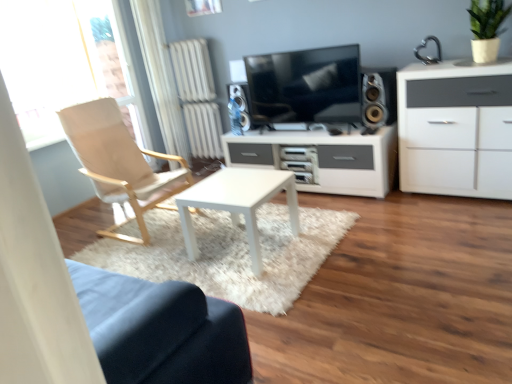
Question: Based on their sizes in the image, would you say matte black tv at center is bigger or smaller than white matte cabinet at right?

Choices:
 (A) small
 (B) big

Answer: (A)

Question: Considering the positions of matte black tv at center and white matte cabinet at right in the image, is matte black tv at center taller or shorter than white matte cabinet at right?

Choices:
 (A) short
 (B) tall

Answer: (A)

Question: Considering the real-world distances, which object is farthest from the light beige fabric chair at left?

Choices:
 (A) white fabric curtain at left
 (B) satin black speaker at center, the second speaker in the front-to-back sequence
 (C) matte black tv at center
 (D) green matte plant at upper right
 (E) silver metallic speaker at right, which ranks as the 2th speaker in left-to-right order

Answer: (D)

Question: Considering the real-world distances, which object is farthest from the white fabric curtain at left?

Choices:
 (A) white matte cabinet at right
 (B) green matte plant at upper right
 (C) white matte coffee table at center
 (D) transparent glass window at upper left
 (E) satin black speaker at center, the second speaker in the front-to-back sequence

Answer: (B)